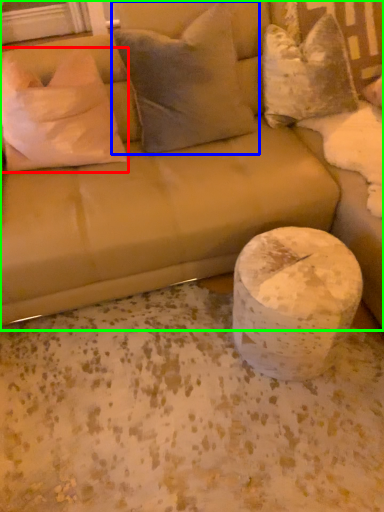
Question: Considering the real-world distances, which object is farthest from pillow (highlighted by a red box)? pillow (highlighted by a blue box) or studio couch (highlighted by a green box)?

Choices:
 (A) pillow
 (B) studio couch

Answer: (A)